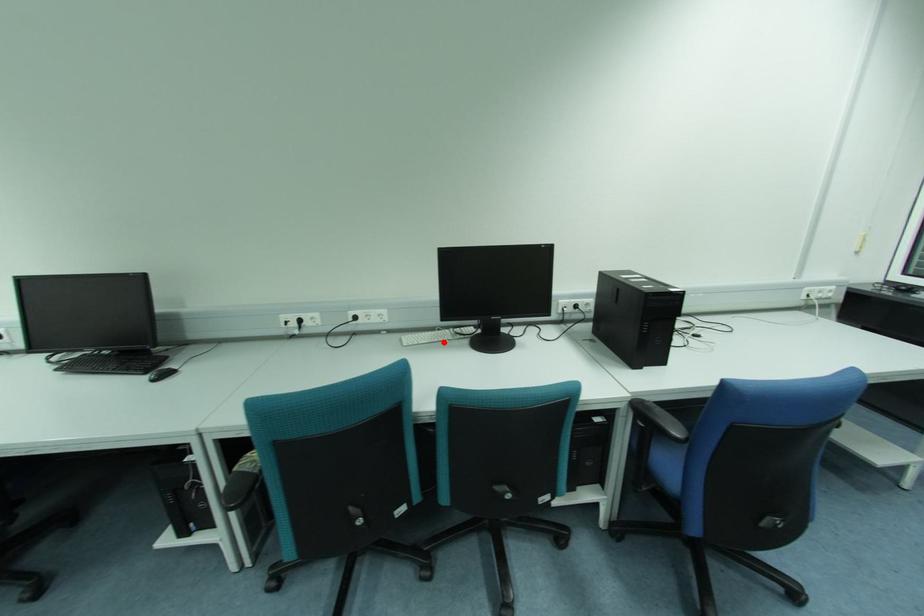
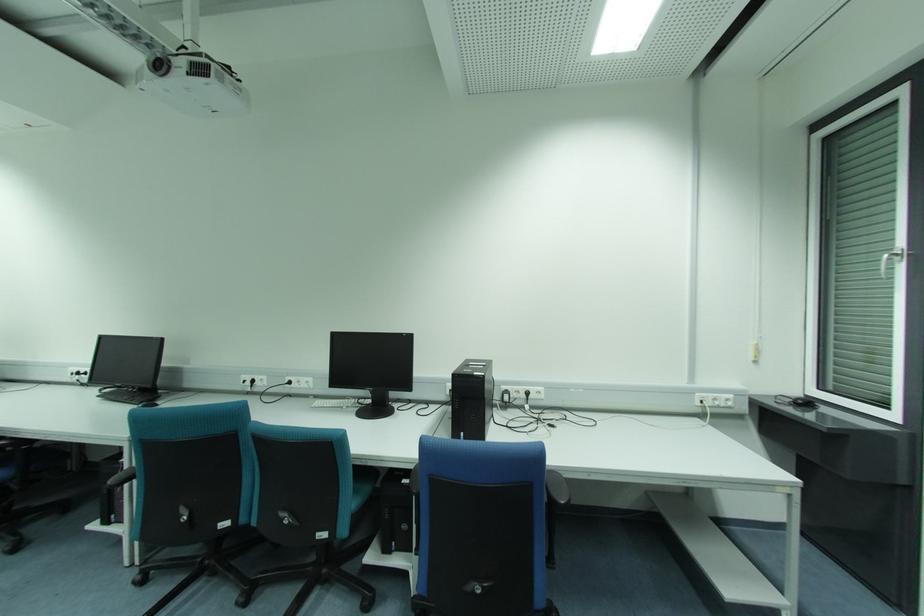
Question: I am providing you with two images of the same scene from different viewpoints. Given a red point in image1, look at the same physical point in image2. Is it:

Choices:
 (A) Closer to the viewpoint
 (B) Farther from the viewpoint

Answer: (B)